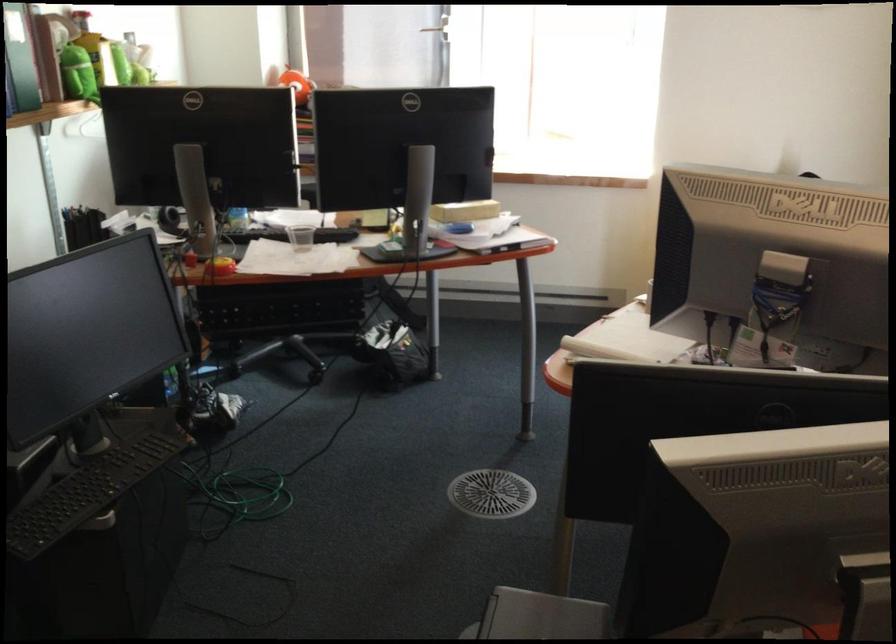
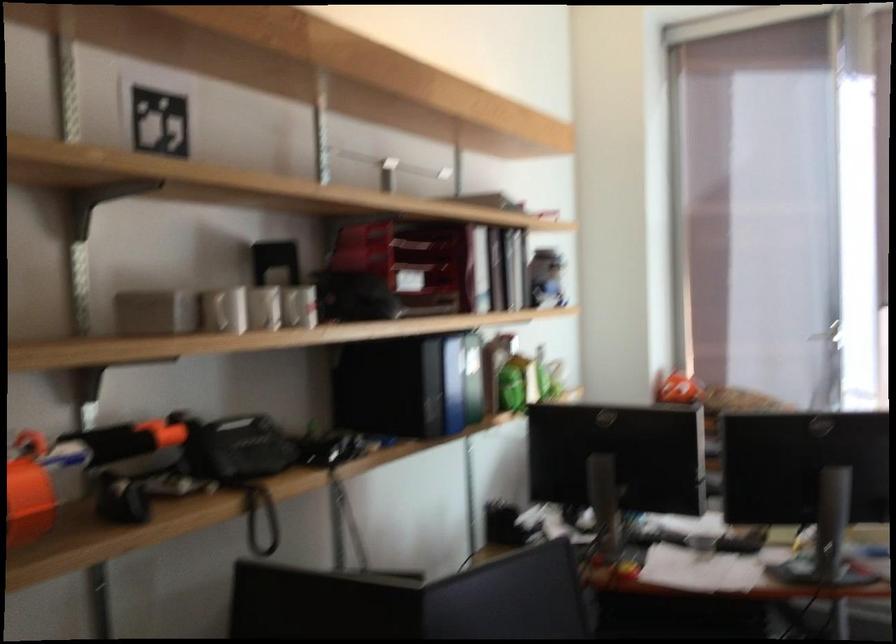
The images are taken continuously from a first-person perspective. In which direction is your viewpoint rotating?

The rotation direction of the camera is left-up.